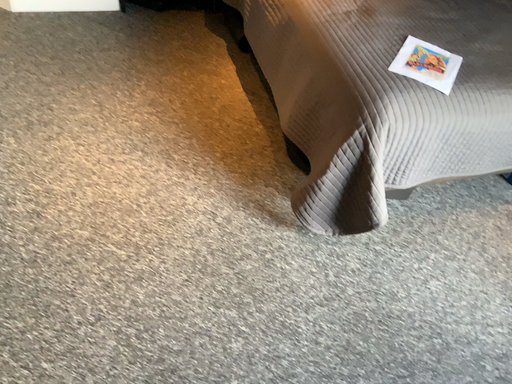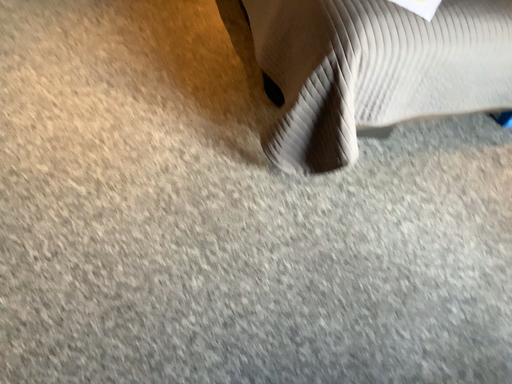
Question: Which way did the camera rotate in the video?

Choices:
 (A) rotated upward
 (B) rotated downward

Answer: (B)